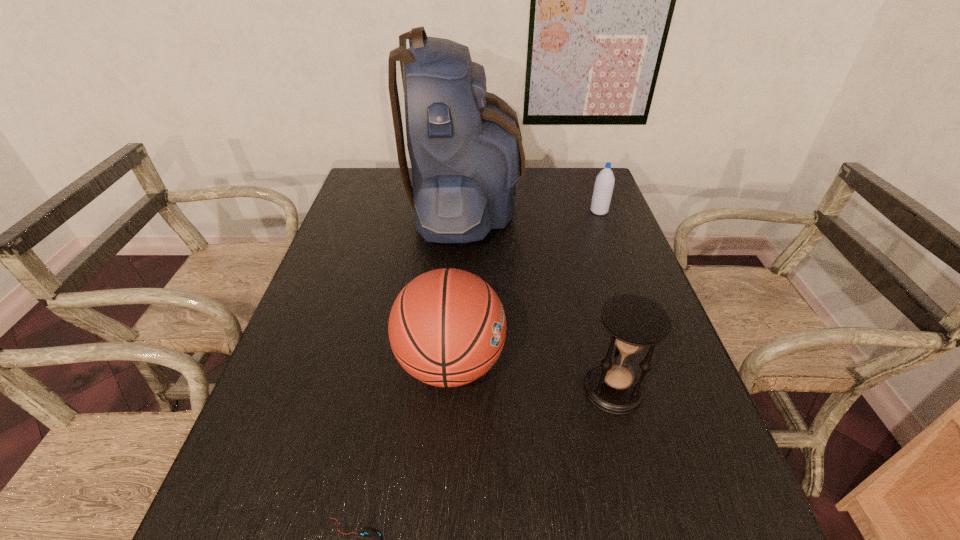
This screenshot has height=540, width=960. Find the location of `hourglass that is positioned at the right edge`. hourglass that is positioned at the right edge is located at coordinates (635, 322).

At what (x,y) coordinates should I click in order to perform the action: click on water bottle that is at the right edge. Please return your answer as a coordinate pair (x, y). The width and height of the screenshot is (960, 540). Looking at the image, I should click on (604, 183).

Where is `vacant space at the far edge`? The image size is (960, 540). vacant space at the far edge is located at coordinates (402, 187).

In the image, there is a desktop. Where is `vacant region at the near edge`? The height and width of the screenshot is (540, 960). vacant region at the near edge is located at coordinates (642, 535).

In the image, there is a desktop. Identify the location of vacant area at the left edge. (287, 525).

I want to click on free space at the right edge, so click(616, 211).

This screenshot has width=960, height=540. Find the location of `empty space that is in between the fourth tallest object and the backpack`. empty space that is in between the fourth tallest object and the backpack is located at coordinates (532, 210).

Find the location of a particular element. The height and width of the screenshot is (540, 960). unoccupied area between the basketball and the second object from right to left is located at coordinates (532, 376).

The height and width of the screenshot is (540, 960). I want to click on vacant point located between the hourglass and the water bottle, so click(x=606, y=300).

Identify the location of object that is the second closest to the nearest object. This screenshot has height=540, width=960. (635, 322).